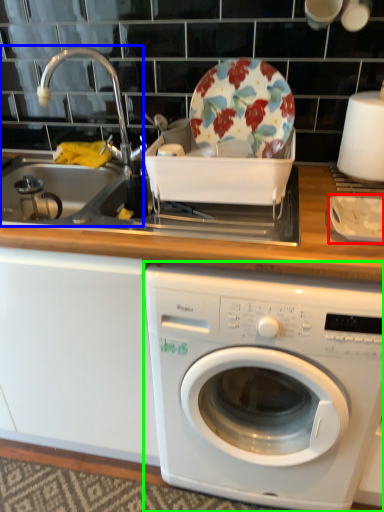
Question: Considering the real-world distances, which object is farthest from tableware (highlighted by a red box)? sink (highlighted by a blue box) or washing machine (highlighted by a green box)?

Choices:
 (A) sink
 (B) washing machine

Answer: (A)